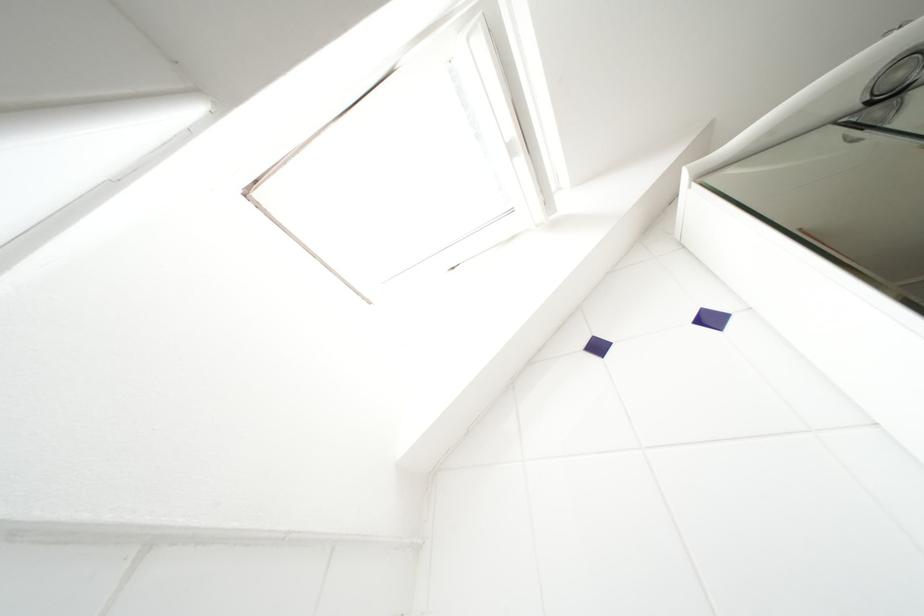
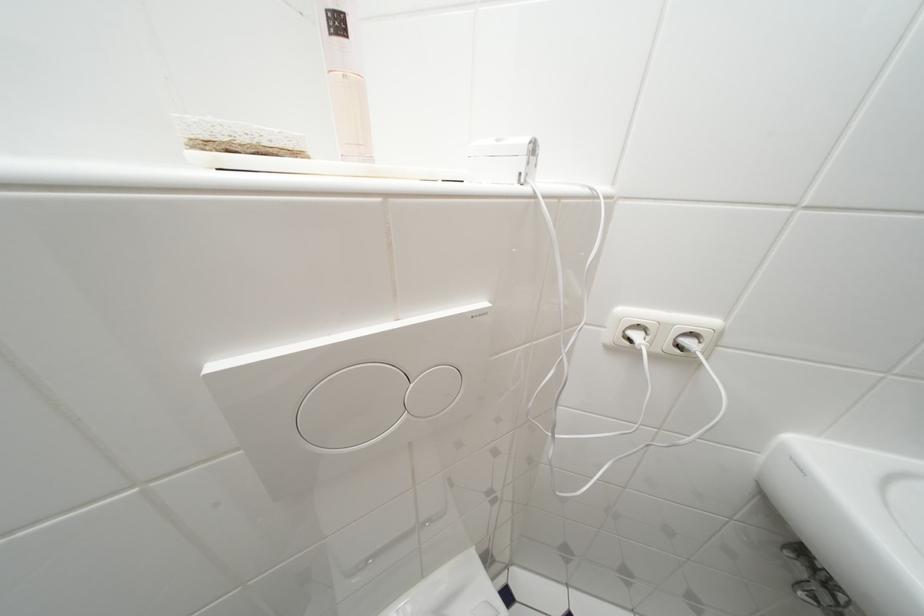
First-person continuous shooting, in which direction is the camera rotating?

The camera's rotation is toward right-down.